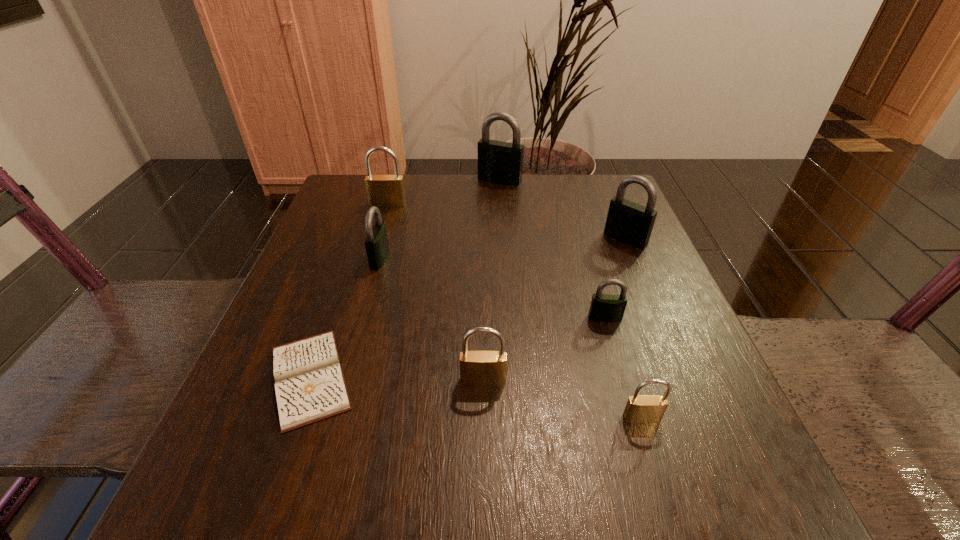
At what (x,y) coordinates should I click in order to perform the action: click on vacant space at the far right corner. Please return your answer as a coordinate pair (x, y). This screenshot has height=540, width=960. Looking at the image, I should click on (577, 198).

This screenshot has height=540, width=960. In the image, there is a desktop. Find the location of `vacant space at the near right corner`. vacant space at the near right corner is located at coordinates (695, 497).

This screenshot has width=960, height=540. In order to click on free space between the third smallest black padlock and the second black padlock from right to left in this screenshot , I will do `click(615, 278)`.

You are a GUI agent. You are given a task and a screenshot of the screen. Output one action in this format:
    pyautogui.click(x=<x>, y=<y>)
    Task: Click on the blank region between the diary and the sixth farthest padlock
    The image size is (960, 540).
    Given the screenshot: What is the action you would take?
    pyautogui.click(x=396, y=379)

I want to click on free space between the shortest object and the rightmost black padlock, so click(468, 308).

What are the coordinates of `empty space between the rightmost padlock and the second brass padlock from right to left` in the screenshot? It's located at (554, 309).

Image resolution: width=960 pixels, height=540 pixels. In order to click on vacant point located between the second nearest padlock and the nearest black padlock in this screenshot , I will do `click(544, 349)`.

You are a GUI agent. You are given a task and a screenshot of the screen. Output one action in this format:
    pyautogui.click(x=<x>, y=<y>)
    Task: Click on the free space between the smallest brass padlock and the second smallest brass padlock
    This screenshot has width=960, height=540.
    Given the screenshot: What is the action you would take?
    pyautogui.click(x=563, y=399)

I want to click on vacant space in between the nearest black padlock and the second smallest black padlock, so click(492, 288).

Find the location of a particular element. vacant space that's between the second farthest object and the shortest object is located at coordinates (349, 291).